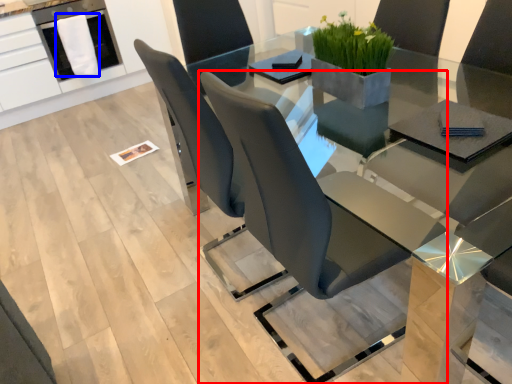
Question: Which of the following is the farthest to the observer, chair (highlighted by a red box) or cloth (highlighted by a blue box)?

Choices:
 (A) chair
 (B) cloth

Answer: (B)